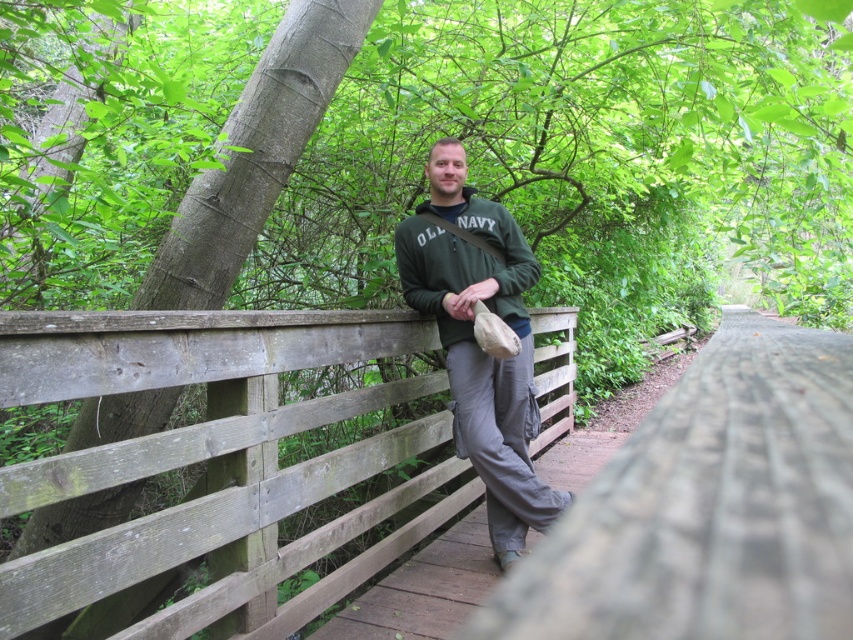
You are standing on the wooden bridge and want to locate the smooth brown wooden fence at center. According to the coordinates provided, where should you look relative to your position?

The smooth brown wooden fence at center is located at coordinates point [709,506], so you should look towards the center of the image to find it.

You are a hiker who wants to cross the brown wooden path at center. You have a backpack that is 3 feet wide. Can you safely walk through the path?

The path between the objects is 8.80 feet wide, which is wider than your backpack of 3 feet. Yes, you can safely walk through the path.

You are a hiker who has just arrived at the wooden bridge. You see the brown wooden path at center and the green fleece sweatshirt at center. Which object is closer to you as you stand on the bridge?

The brown wooden path at center is closer to you because it is in front of the green fleece sweatshirt at center.